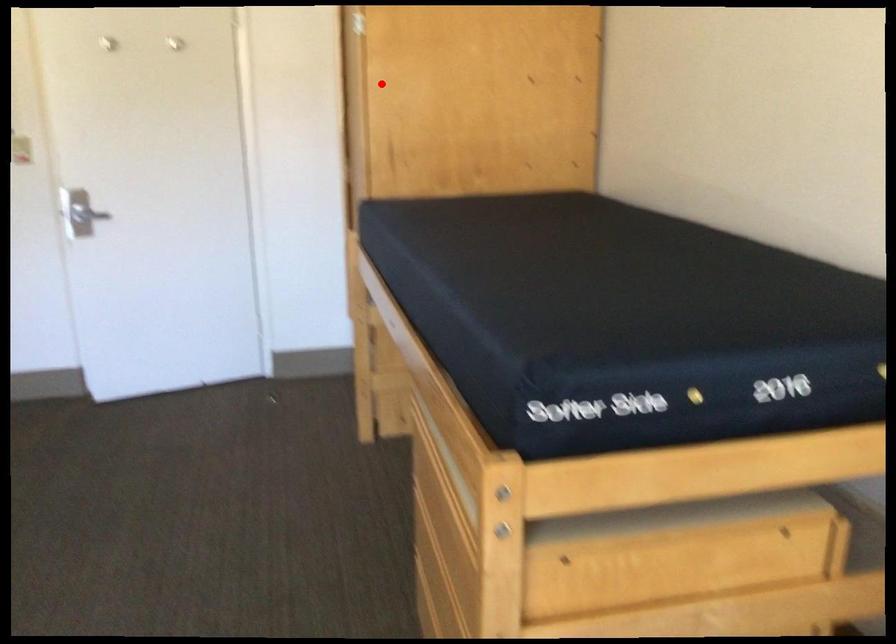
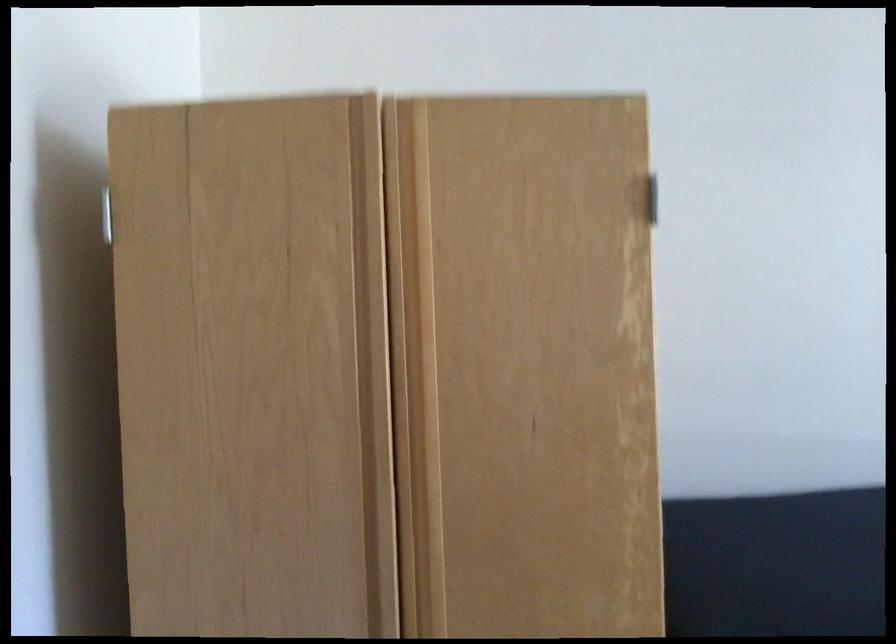
In the second image, find the point that corresponds to the highlighted location in the first image.

(414, 368)